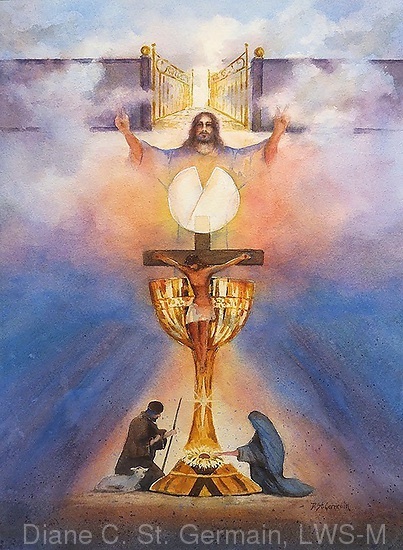
Locate an element on the screen. Image resolution: width=403 pixels, height=550 pixels. crucifix is located at coordinates (202, 252).